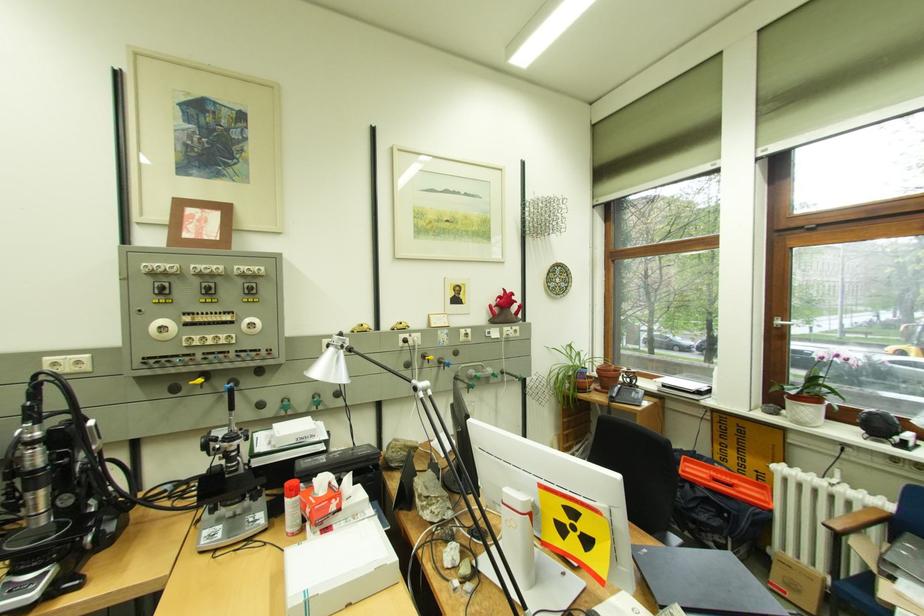
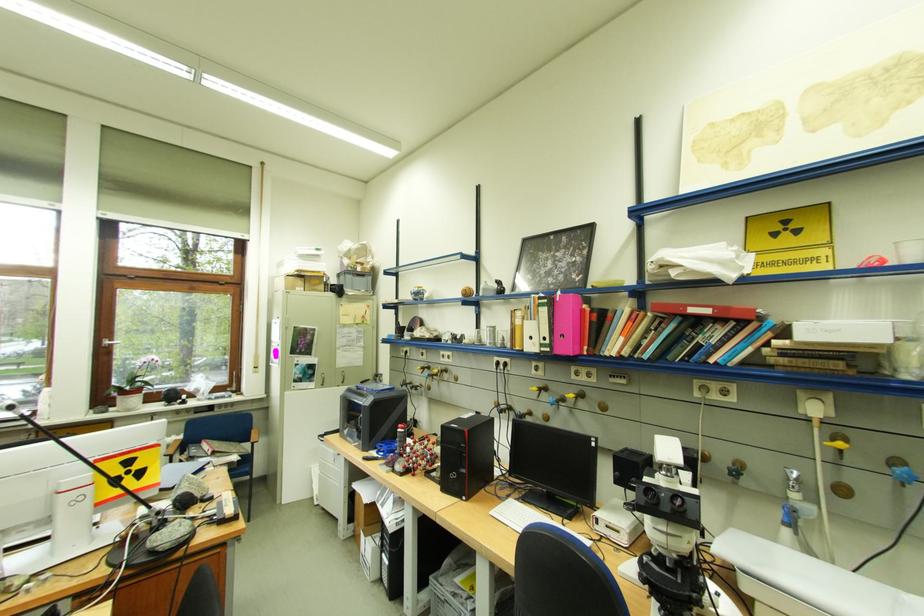
Find the pixel in the second image that matches the point at 798,403 in the first image.

(130, 399)